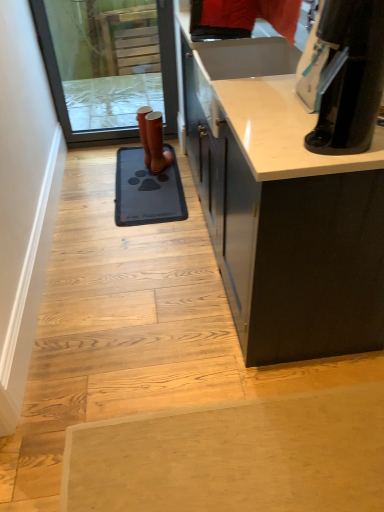
Question: Is black glossy coffee maker at upper right positioned before blue rubber doormat at center?

Choices:
 (A) yes
 (B) no

Answer: (A)

Question: From a real-world perspective, does black glossy coffee maker at upper right stand above blue rubber doormat at center?

Choices:
 (A) yes
 (B) no

Answer: (A)

Question: Can you confirm if black glossy coffee maker at upper right is shorter than blue rubber doormat at center?

Choices:
 (A) yes
 (B) no

Answer: (B)

Question: Is black glossy coffee maker at upper right far away from blue rubber doormat at center?

Choices:
 (A) no
 (B) yes

Answer: (B)

Question: Does black glossy coffee maker at upper right lie behind blue rubber doormat at center?

Choices:
 (A) no
 (B) yes

Answer: (A)

Question: Can you confirm if black glossy coffee maker at upper right is thinner than blue rubber doormat at center?

Choices:
 (A) no
 (B) yes

Answer: (B)

Question: From a real-world perspective, is brown leather boot at center positioned under transparent glass screen door at upper left based on gravity?

Choices:
 (A) no
 (B) yes

Answer: (B)

Question: Does brown leather boot at center have a lesser width compared to transparent glass screen door at upper left?

Choices:
 (A) no
 (B) yes

Answer: (A)

Question: Can you confirm if brown leather boot at center is positioned to the right of transparent glass screen door at upper left?

Choices:
 (A) no
 (B) yes

Answer: (B)

Question: Considering the relative sizes of brown leather boot at center and transparent glass screen door at upper left in the image provided, is brown leather boot at center shorter than transparent glass screen door at upper left?

Choices:
 (A) no
 (B) yes

Answer: (B)

Question: Is transparent glass screen door at upper left located within brown leather boot at center?

Choices:
 (A) no
 (B) yes

Answer: (A)

Question: Does brown leather boot at center turn towards transparent glass screen door at upper left?

Choices:
 (A) no
 (B) yes

Answer: (A)

Question: Is blue rubber doormat at center smaller than white smooth door at left?

Choices:
 (A) no
 (B) yes

Answer: (B)